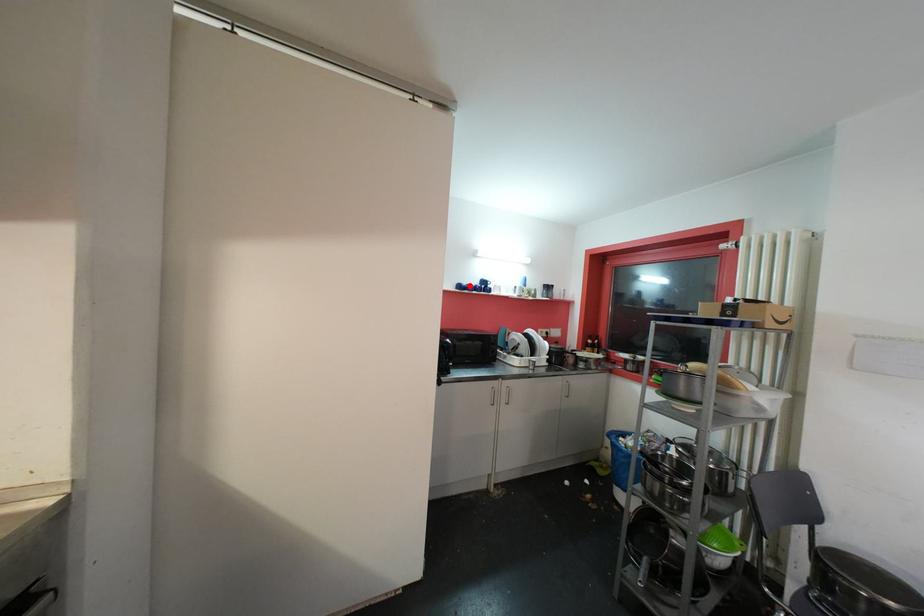
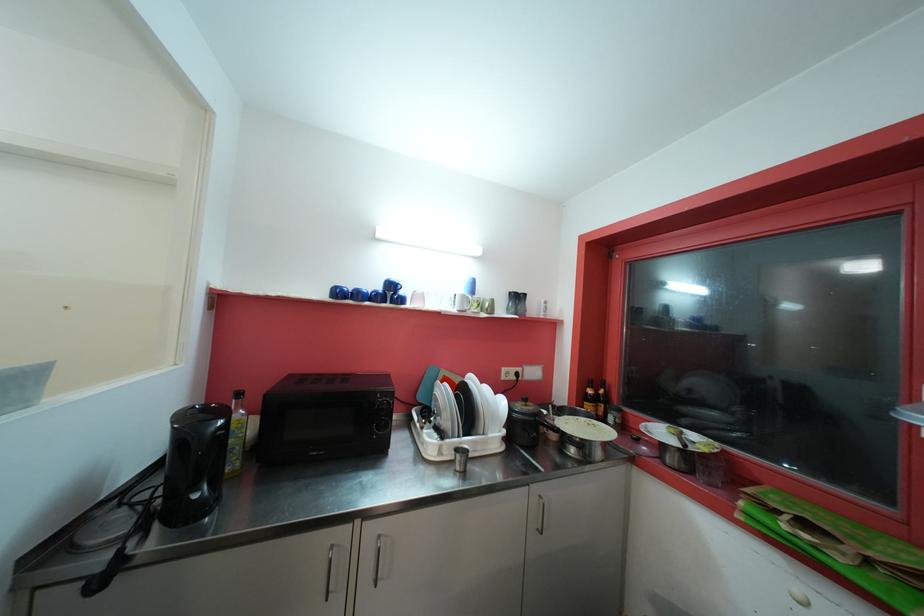
Where in the second image is the point corresponding to the highlighted location from the first image?

(354, 290)